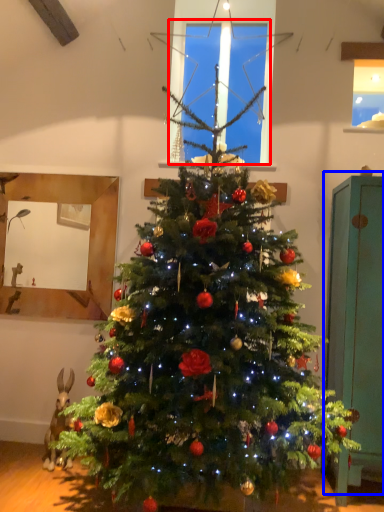
Question: Which of the following is the closest to the observer, window screen (highlighted by a red box) or armoire (highlighted by a blue box)?

Choices:
 (A) window screen
 (B) armoire

Answer: (B)